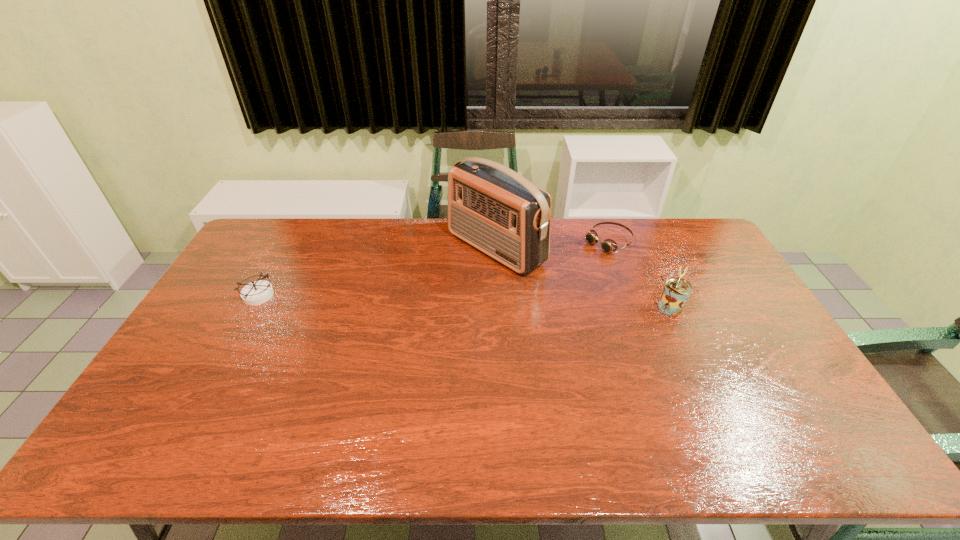
Where is `free space between the shortest object and the second shortest object`? The width and height of the screenshot is (960, 540). free space between the shortest object and the second shortest object is located at coordinates (433, 269).

This screenshot has width=960, height=540. What are the coordinates of `unoccupied position between the can and the compass` in the screenshot? It's located at (466, 302).

Find the location of a particular element. Image resolution: width=960 pixels, height=540 pixels. object identified as the second closest to the compass is located at coordinates (608, 245).

Where is `the closest object relative to the goggles`? Image resolution: width=960 pixels, height=540 pixels. the closest object relative to the goggles is located at coordinates [491, 207].

At what (x,y) coordinates should I click in order to perform the action: click on vacant space that satisfies the following two spatial constraints: 1. on the back side of the tallest object; 2. on the right side of the third tallest object. Please return your answer as a coordinate pair (x, y). Image resolution: width=960 pixels, height=540 pixels. Looking at the image, I should click on (284, 248).

Where is `vacant space that satisfies the following two spatial constraints: 1. on the front side of the can; 2. on the left side of the goggles`? vacant space that satisfies the following two spatial constraints: 1. on the front side of the can; 2. on the left side of the goggles is located at coordinates (633, 308).

Locate an element on the screen. This screenshot has height=540, width=960. free region that satisfies the following two spatial constraints: 1. on the front side of the leftmost object; 2. on the left side of the second tallest object is located at coordinates (252, 308).